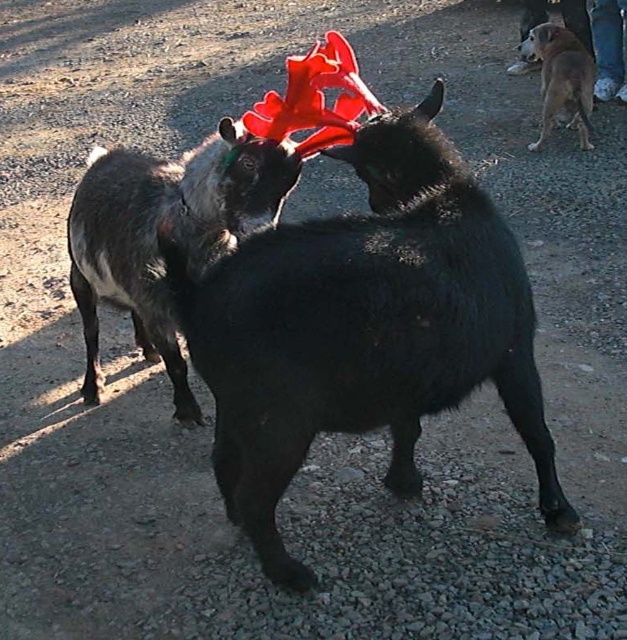
You are a photographer standing 6 feet away from the black matte antlers at center. Can you reach out and touch them without moving your feet?

The black matte antlers at center is 5.56 feet from viewer. Since you are standing 6 feet away, you cannot reach them without moving closer.

You are a photographer trying to capture both the black matte antlers at center and the brown furry dog at upper right in a single frame. Based on their positions and sizes, do you think you can fit both into your camera viewfinder without zooming in?

The black matte antlers at center might be wider than brown furry dog at upper right, so it is possible to fit both into the camera viewfinder without zooming in, as the antlers are wider and likely take up more horizontal space, allowing the dog to be included in the frame.